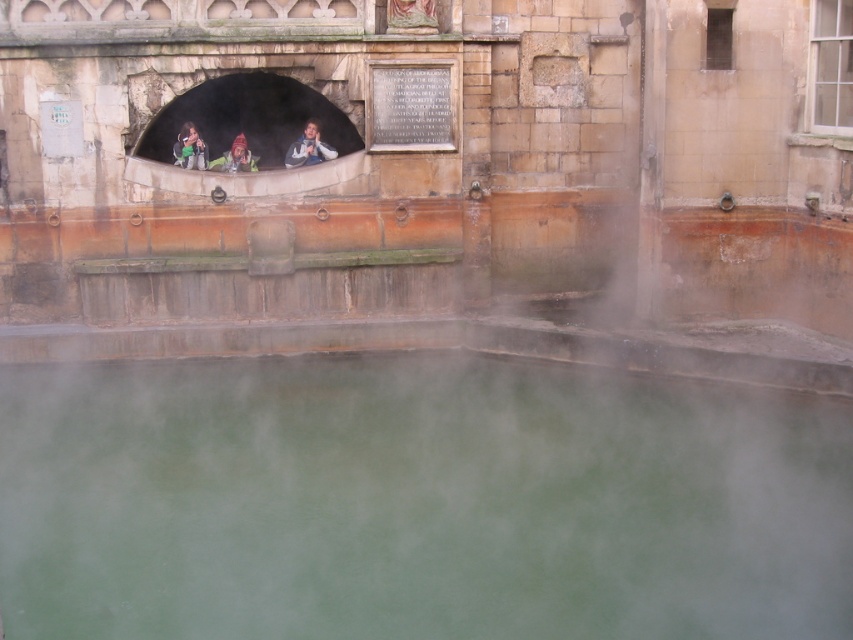
You are standing at the entrance of the Roman bath complex and want to take a photo of the green opaque water at center. According to the coordinates provided, where should you position yourself to ensure the water is in the center of your photo?

To ensure the green opaque water at center is centered in your photo, position yourself so that the water aligns with the coordinates point at (416, 500).

You are standing in front of the historical stone structure and want to locate the green fabric jacket at upper center. According to the coordinates provided, where should you look to find it?

The green fabric jacket at upper center is located at the 2D coordinates point (189, 148).

Consider the image. You are standing in front of the historical stone structure. You want to take a photo of the green opaque water at center without the green fabric jacket at upper center appearing in the frame. Is this possible based on their positions?

The green opaque water at center is closer to the viewer than the green fabric jacket at upper center, so you can position yourself so that the jacket is out of the frame while focusing on the water.